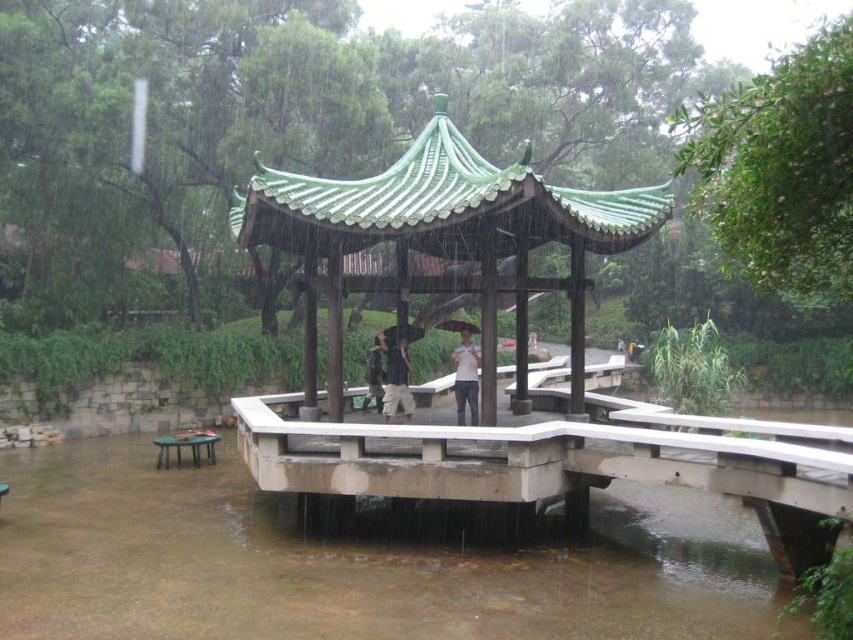
Question: Which point appears farthest from the camera in this image?

Choices:
 (A) (369, 380)
 (B) (161, 448)
 (C) (412, 237)

Answer: (B)

Question: Is dark blue fabric umbrella at center positioned behind transparent plastic umbrella at center?

Choices:
 (A) yes
 (B) no

Answer: (B)

Question: Which object is positioned closest to the clear concrete flood at lower center?

Choices:
 (A) green glazed tile gazebo at center
 (B) dark blue fabric umbrella at center
 (C) white matte shirt at center
 (D) transparent plastic umbrella at center

Answer: (A)

Question: Does white matte shirt at center lie in front of black matte umbrella at center?

Choices:
 (A) yes
 (B) no

Answer: (A)

Question: Does green glazed tile gazebo at center have a lesser width compared to dark blue fabric umbrella at center?

Choices:
 (A) no
 (B) yes

Answer: (A)

Question: Which object appears farthest from the camera in this image?

Choices:
 (A) transparent plastic umbrella at center
 (B) dark blue fabric umbrella at center

Answer: (A)